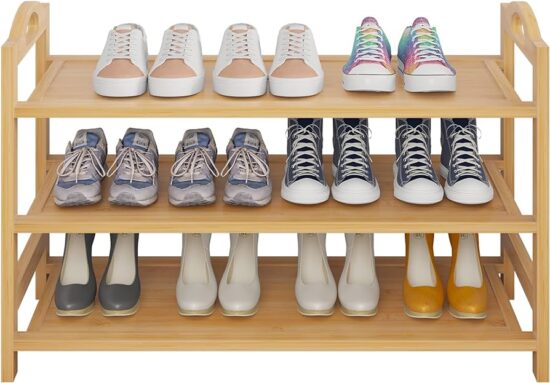
The width and height of the screenshot is (550, 383). Identify the location of shoes on the top shelf. (125, 65), (181, 64), (251, 63), (293, 70), (373, 60), (430, 63).